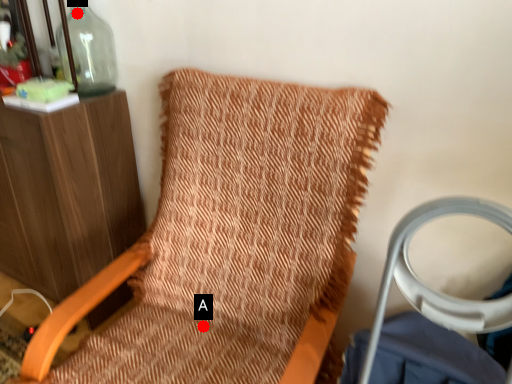
Question: Two points are circled on the image, labeled by A and B beside each circle. Which of the following is the closest to the observer?

Choices:
 (A) A is closer
 (B) B is closer

Answer: (A)